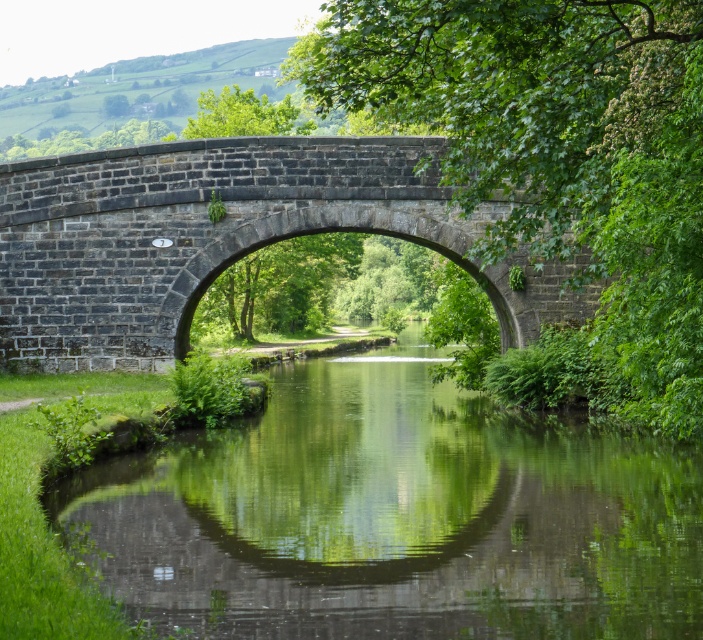
Question: Does green reflective water at center have a lesser width compared to dark gray stone bridge at center?

Choices:
 (A) no
 (B) yes

Answer: (B)

Question: Which object appears closest to the camera in this image?

Choices:
 (A) green reflective water at center
 (B) dark gray stone bridge at center

Answer: (A)

Question: Which object is farther from the camera taking this photo?

Choices:
 (A) dark gray stone bridge at center
 (B) green reflective water at center

Answer: (A)

Question: Can you confirm if green reflective water at center is positioned to the right of dark gray stone bridge at center?

Choices:
 (A) yes
 (B) no

Answer: (A)

Question: Does green reflective water at center have a lesser width compared to dark gray stone bridge at center?

Choices:
 (A) no
 (B) yes

Answer: (B)

Question: Which object appears farthest from the camera in this image?

Choices:
 (A) dark gray stone bridge at center
 (B) green reflective water at center

Answer: (A)